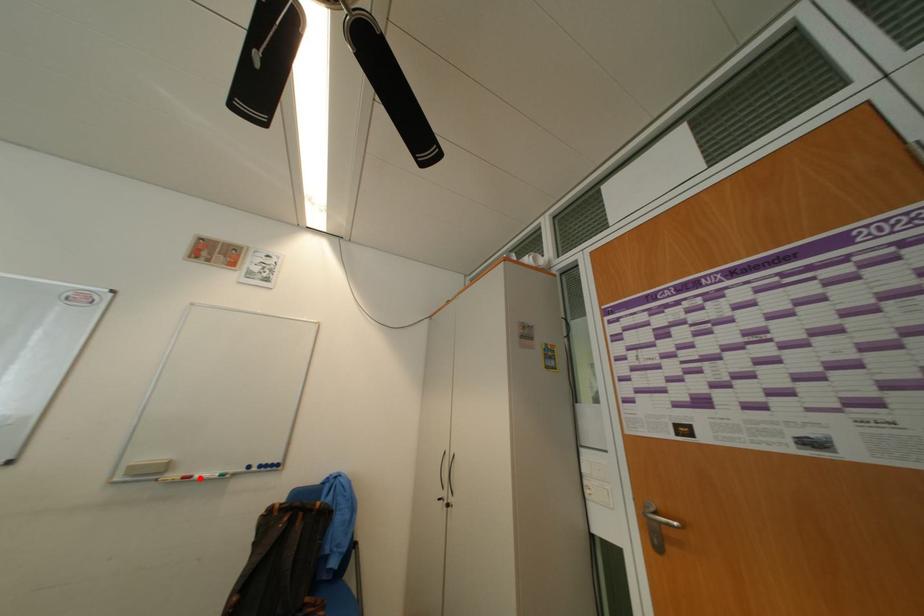
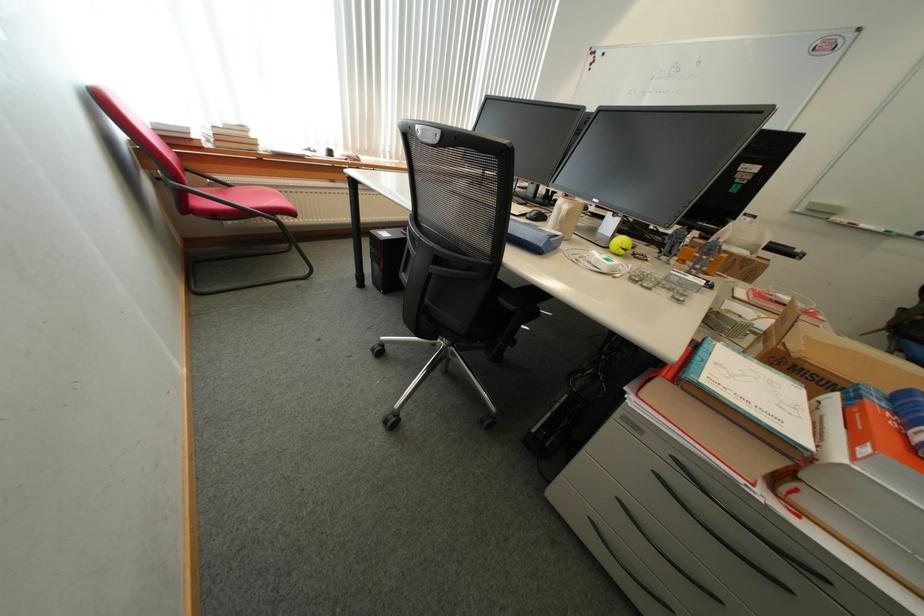
Question: I am providing you with two images of the same scene from different viewpoints. A red point is shown in image1. For the corresponding object point in image2, is it positioned nearer or farther from the camera?

Choices:
 (A) Nearer
 (B) Farther

Answer: (B)